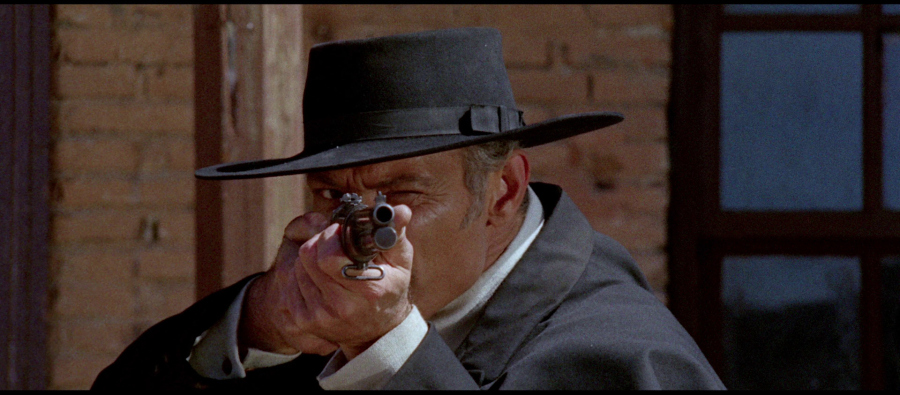
The height and width of the screenshot is (395, 900). What are the coordinates of `window` in the screenshot? It's located at (814, 135).